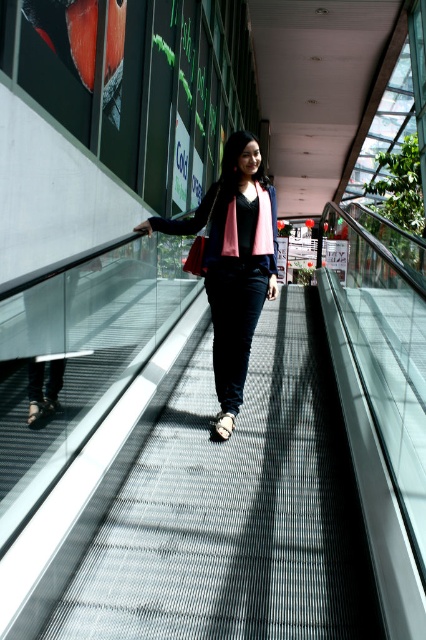
Question: Which object is farther from the camera taking this photo?

Choices:
 (A) matte black jacket at center
 (B) metallic gray escalator at center

Answer: (A)

Question: Can you confirm if metallic gray escalator at center is thinner than matte black jacket at center?

Choices:
 (A) yes
 (B) no

Answer: (B)

Question: Which point appears farthest from the camera in this image?

Choices:
 (A) (233, 324)
 (B) (276, 416)

Answer: (B)

Question: In this image, where is metallic gray escalator at center located relative to matte black jacket at center?

Choices:
 (A) above
 (B) below

Answer: (B)

Question: Considering the relative positions of metallic gray escalator at center and matte black jacket at center in the image provided, where is metallic gray escalator at center located with respect to matte black jacket at center?

Choices:
 (A) below
 (B) above

Answer: (A)